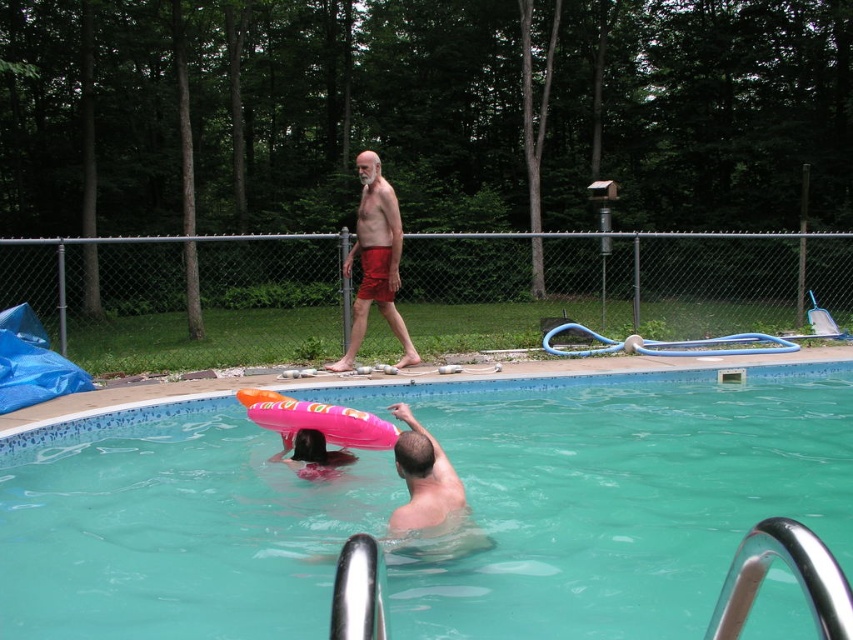
You are a photographer positioned at the edge of the pool. You want to capture a photo that includes both the point at coordinates point (x=364, y=288) and point (x=349, y=458). Since you want the closer object to be in focus, which point should you focus on?

Point (x=349, y=458) is closer to the camera than point (x=364, y=288), so you should focus on point (x=349, y=458) to have the closer object in focus.

You are a photographer positioned at the edge of the pool. You want to capture a photo that includes both the teal smooth water at center and the matte red shorts at center. Based on their positions, which object should you focus on first to ensure both are in the frame?

The teal smooth water at center is in front of the matte red shorts at center, so you should focus on the teal smooth water at center first to ensure both are in the frame.